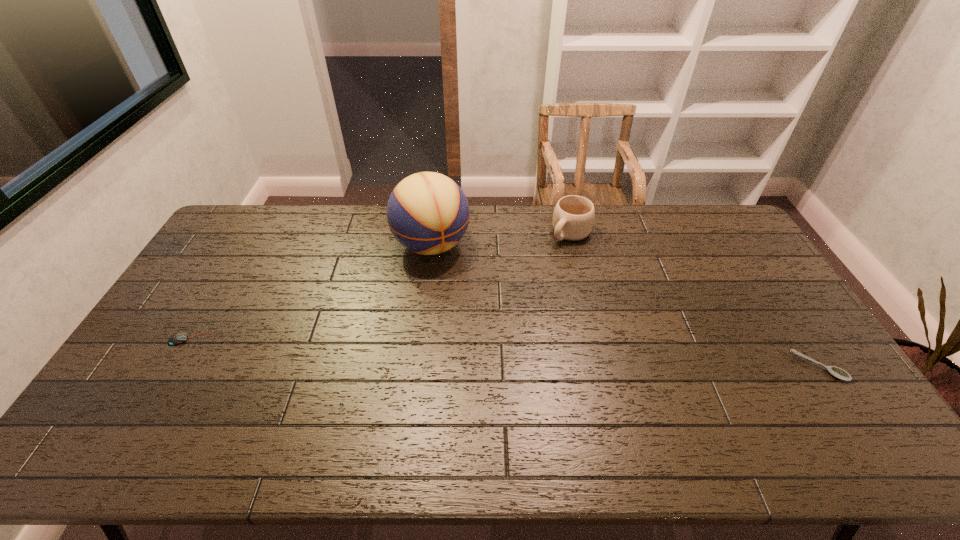
You are a GUI agent. You are given a task and a screenshot of the screen. Output one action in this format:
    pyautogui.click(x=<x>, y=<y>)
    Task: Click on the blank area at the far edge
    Image resolution: width=960 pixels, height=540 pixels.
    Given the screenshot: What is the action you would take?
    pyautogui.click(x=367, y=222)

In the image, there is a desktop. At what (x,y) coordinates should I click in order to perform the action: click on free region at the left edge. Please return your answer as a coordinate pair (x, y). This screenshot has width=960, height=540. Looking at the image, I should click on (221, 267).

Locate an element on the screen. The width and height of the screenshot is (960, 540). vacant space at the right edge of the desktop is located at coordinates (712, 248).

Locate an element on the screen. The image size is (960, 540). vacant space at the far left corner of the desktop is located at coordinates (247, 237).

This screenshot has width=960, height=540. I want to click on vacant area at the near left corner of the desktop, so click(118, 406).

Identify the location of blank region between the nearest object and the third shortest object. (694, 300).

You are a GUI agent. You are given a task and a screenshot of the screen. Output one action in this format:
    pyautogui.click(x=<x>, y=<y>)
    Task: Click on the vacant space that's between the mouse and the basketball
    This screenshot has height=540, width=960.
    Given the screenshot: What is the action you would take?
    pyautogui.click(x=311, y=292)

The width and height of the screenshot is (960, 540). I want to click on free space between the third shortest object and the basketball, so click(501, 239).

Locate an element on the screen. vacant area between the third shortest object and the leftmost object is located at coordinates (381, 286).

You are a GUI agent. You are given a task and a screenshot of the screen. Output one action in this format:
    pyautogui.click(x=<x>, y=<y>)
    Task: Click on the free spot between the nearest object and the mug
    The height and width of the screenshot is (540, 960).
    Given the screenshot: What is the action you would take?
    pyautogui.click(x=694, y=300)